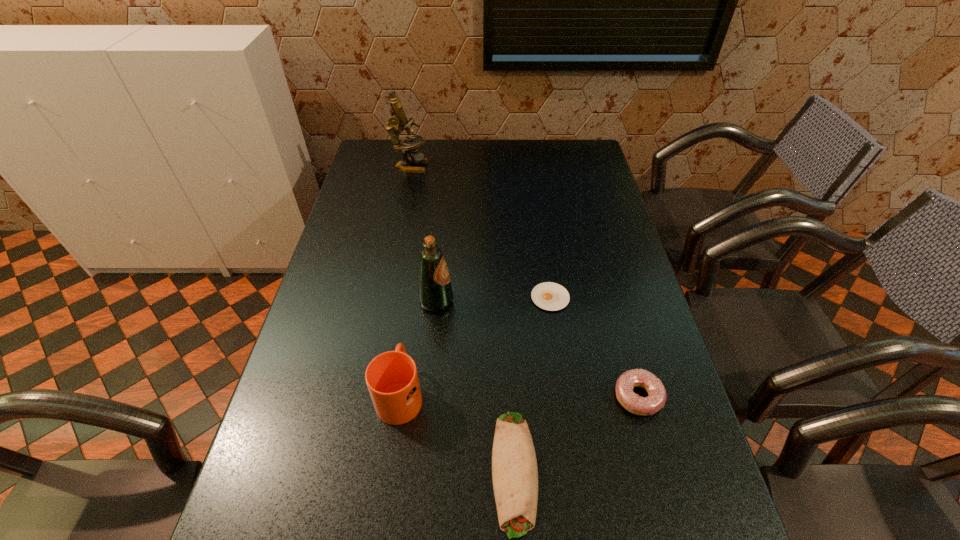
You are a GUI agent. You are given a task and a screenshot of the screen. Output one action in this format:
    pyautogui.click(x=<x>, y=<y>)
    Task: Click on the tallest object
    
    Given the screenshot: What is the action you would take?
    pyautogui.click(x=398, y=118)

You are a GUI agent. You are given a task and a screenshot of the screen. Output one action in this format:
    pyautogui.click(x=<x>, y=<y>)
    Task: Click on the microscope
    The height and width of the screenshot is (540, 960).
    Given the screenshot: What is the action you would take?
    398,118

Where is `the fifth shortest object`? The width and height of the screenshot is (960, 540). the fifth shortest object is located at coordinates (435, 293).

Image resolution: width=960 pixels, height=540 pixels. Identify the location of mug. (392, 379).

The height and width of the screenshot is (540, 960). Find the location of `the rightmost object`. the rightmost object is located at coordinates (632, 402).

Locate an element on the screen. The image size is (960, 540). the third shortest object is located at coordinates (632, 402).

Locate an element on the screen. The width and height of the screenshot is (960, 540). the shortest object is located at coordinates (550, 296).

You are a GUI agent. You are given a task and a screenshot of the screen. Output one action in this format:
    pyautogui.click(x=<x>, y=<y>)
    Task: Click on the fifth object from left to right
    
    Given the screenshot: What is the action you would take?
    pyautogui.click(x=550, y=296)

The image size is (960, 540). Identify the location of free space located on the front of the microscope. (396, 231).

Identify the location of blank space located 0.110m on the front-facing side of the olive oil. Image resolution: width=960 pixels, height=540 pixels. (493, 301).